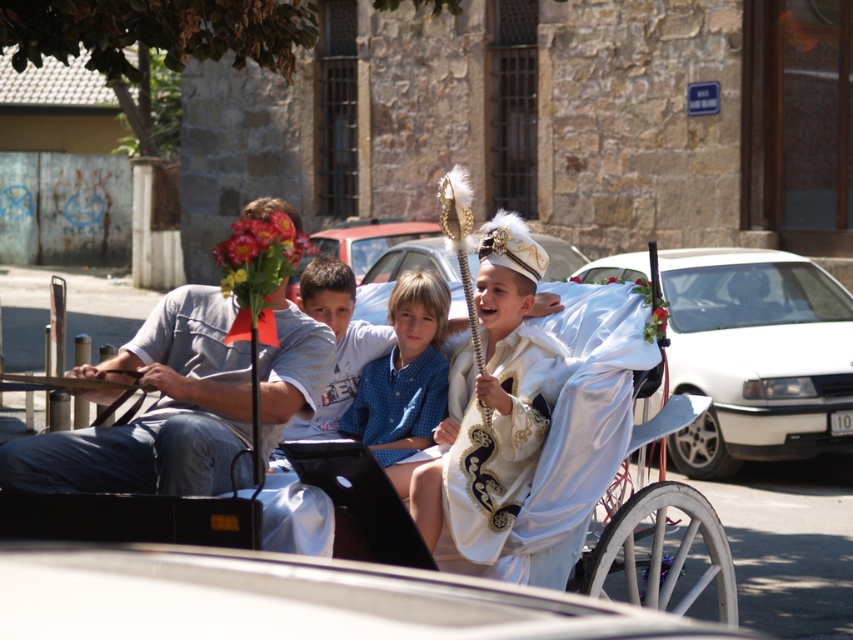
Question: Based on their relative distances, which object is farther from the light blue shirt at center?

Choices:
 (A) blue checkered shirt at center
 (B) gray cotton shirt at left
 (C) white satin horse cart at center

Answer: (C)

Question: Can you confirm if white satin horse cart at center is wider than light blue shirt at center?

Choices:
 (A) no
 (B) yes

Answer: (B)

Question: Which object is the farthest from the white satin horse cart at center?

Choices:
 (A) blue checkered shirt at center
 (B) gray cotton shirt at left
 (C) light blue shirt at center

Answer: (A)

Question: Which of the following is the farthest from the observer?

Choices:
 (A) blue checkered shirt at center
 (B) white satin horse cart at center

Answer: (A)

Question: From the image, what is the correct spatial relationship of white satin horse cart at center in relation to blue checkered shirt at center?

Choices:
 (A) above
 (B) below

Answer: (B)

Question: Is gray cotton shirt at left further to camera compared to blue checkered shirt at center?

Choices:
 (A) yes
 (B) no

Answer: (B)